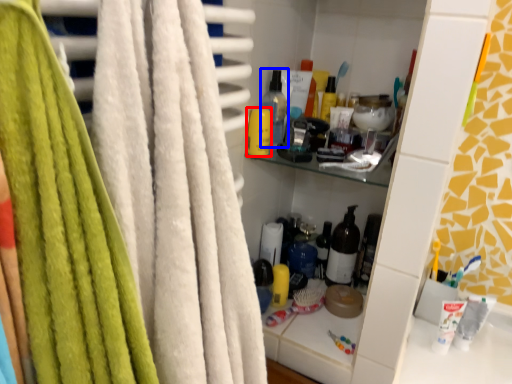
Question: Which point is further to the camera, toiletry (highlighted by a red box) or bottle (highlighted by a blue box)?

Choices:
 (A) toiletry
 (B) bottle

Answer: (B)